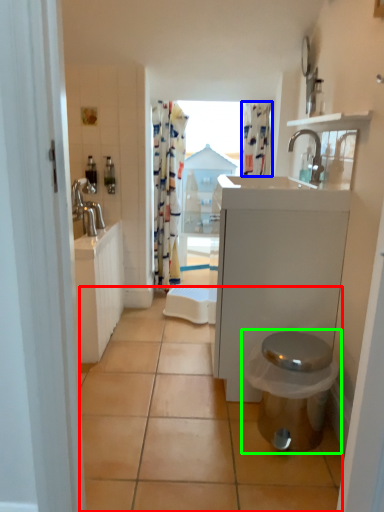
Question: Estimate the real-world distances between objects in this image. Which object is farther from tile (highlighted by a red box), shower curtain (highlighted by a blue box) or toilet (highlighted by a green box)?

Choices:
 (A) shower curtain
 (B) toilet

Answer: (A)